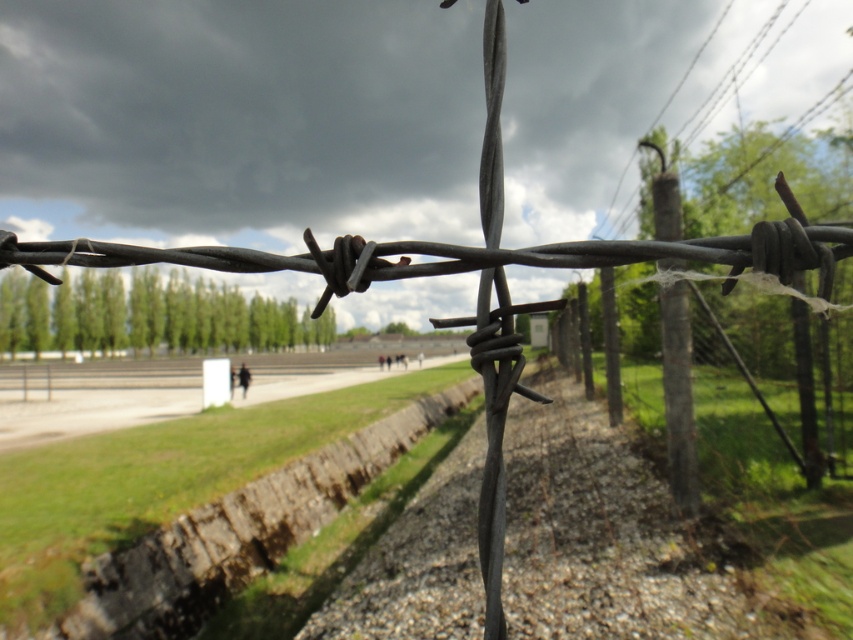
You are standing in front of the barbed wire fence and want to determine the relative positions of two points marked on the image. Which of the two points, point (x=379, y=470) or point (x=831, y=268), is closer to you?

Point (x=379, y=470) is further to the camera than point (x=831, y=268), so the point closer to you is point (x=831, y=268).

You are a delivery drone flying over a field. You need to drop a package into the rusty concrete trench at center without hitting the rusty wire fence at center. Based on the scene description, can you safely do this?

The rusty concrete trench at center is positioned under the rusty wire fence at center, so the drone can safely drop the package into the trench without hitting the fence.